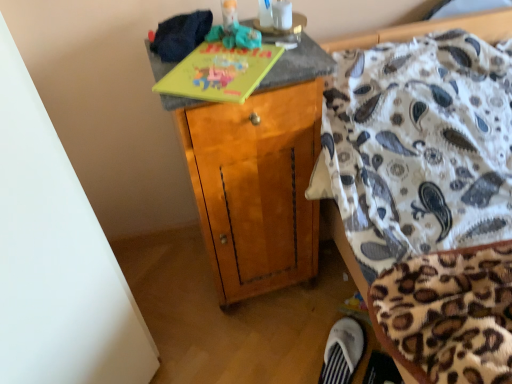
Question: Is wooden cabinet at center aimed at yellow matte book at upper center?

Choices:
 (A) no
 (B) yes

Answer: (A)

Question: Does wooden cabinet at center contain yellow matte book at upper center?

Choices:
 (A) no
 (B) yes

Answer: (B)

Question: From a real-world perspective, is wooden cabinet at center located higher than yellow matte book at upper center?

Choices:
 (A) no
 (B) yes

Answer: (A)

Question: Considering the relative sizes of wooden cabinet at center and yellow matte book at upper center in the image provided, is wooden cabinet at center wider than yellow matte book at upper center?

Choices:
 (A) yes
 (B) no

Answer: (A)

Question: Considering the relative positions of wooden cabinet at center and yellow matte book at upper center in the image provided, is wooden cabinet at center in front of yellow matte book at upper center?

Choices:
 (A) no
 (B) yes

Answer: (A)

Question: Is white fabric slipper at lower right wider or thinner than yellow matte book at upper center?

Choices:
 (A) wide
 (B) thin

Answer: (B)

Question: In terms of height, does white fabric slipper at lower right look taller or shorter compared to yellow matte book at upper center?

Choices:
 (A) tall
 (B) short

Answer: (A)

Question: From the image's perspective, is white fabric slipper at lower right located above or below yellow matte book at upper center?

Choices:
 (A) above
 (B) below

Answer: (B)

Question: From a real-world perspective, relative to yellow matte book at upper center, is white fabric slipper at lower right vertically above or below?

Choices:
 (A) above
 (B) below

Answer: (B)

Question: From the image's perspective, relative to white fabric slipper at lower right, is rubberized green toy at upper center above or below?

Choices:
 (A) below
 (B) above

Answer: (B)

Question: Is rubberized green toy at upper center inside the boundaries of white fabric slipper at lower right, or outside?

Choices:
 (A) inside
 (B) outside

Answer: (B)

Question: Relative to white fabric slipper at lower right, is rubberized green toy at upper center in front or behind?

Choices:
 (A) front
 (B) behind

Answer: (A)

Question: Is rubberized green toy at upper center bigger or smaller than white fabric slipper at lower right?

Choices:
 (A) big
 (B) small

Answer: (B)

Question: In the image, is yellow matte book at upper center on the left side or the right side of wooden cabinet at center?

Choices:
 (A) left
 (B) right

Answer: (A)

Question: Is yellow matte book at upper center inside the boundaries of wooden cabinet at center, or outside?

Choices:
 (A) inside
 (B) outside

Answer: (A)